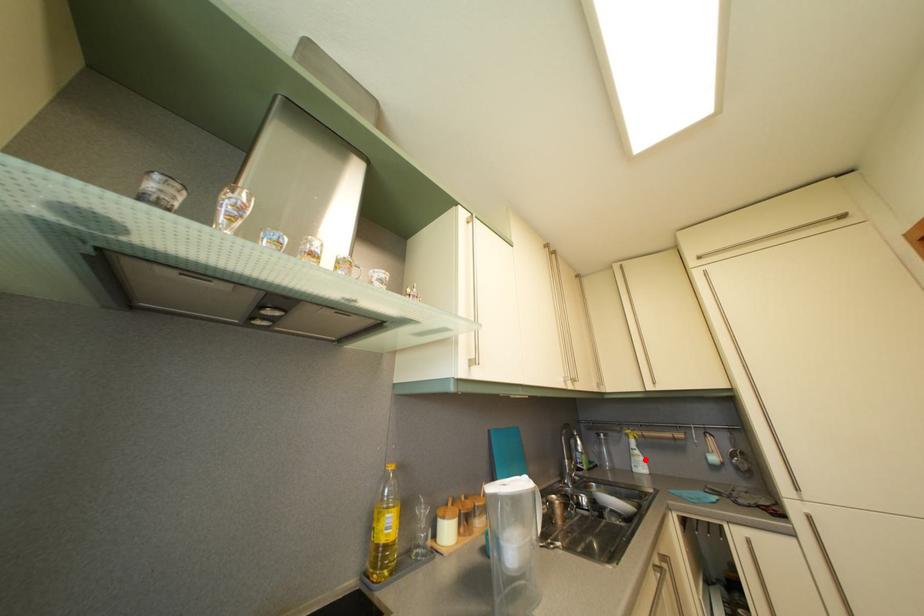
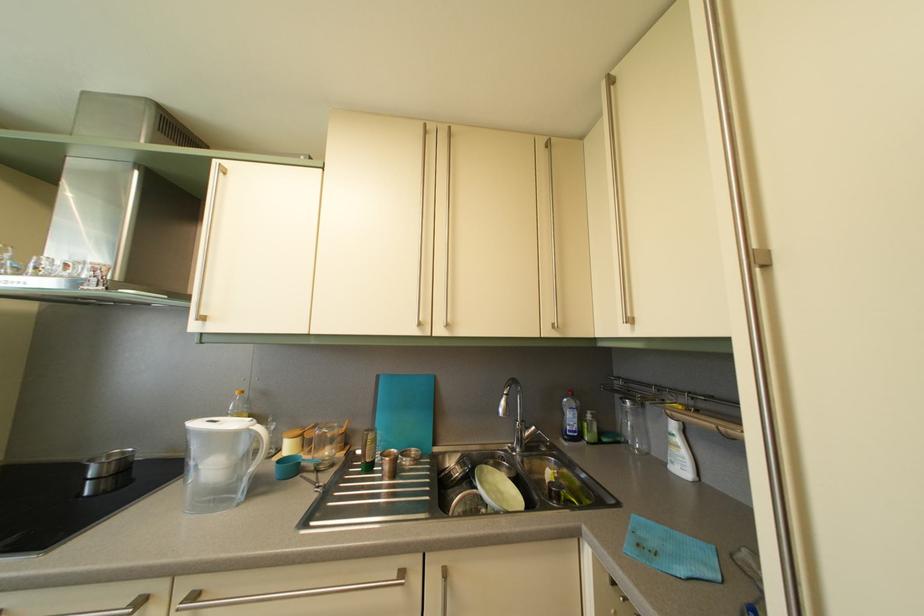
The point at the highlighted location is marked in the first image. Where is the corresponding point in the second image?

(687, 448)